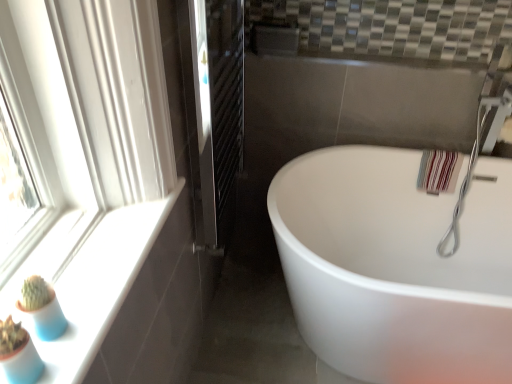
Where is `silver metallic faucet at upper right`? The height and width of the screenshot is (384, 512). silver metallic faucet at upper right is located at coordinates (483, 132).

Locate an element on the screen. The image size is (512, 384). white glossy window sill at lower left is located at coordinates (100, 285).

Is white glossy bathtub at center taller than black metal radiator at center?

No.

What's the angular difference between white glossy bathtub at center and black metal radiator at center's facing directions?

They differ by 88.9 degrees in their facing directions.

Which object is closer to the camera, white glossy bathtub at center or black metal radiator at center?

black metal radiator at center is closer to the camera.

Considering the sizes of objects white glossy bathtub at center and black metal radiator at center in the image provided, who is smaller, white glossy bathtub at center or black metal radiator at center?

black metal radiator at center.

From the image's perspective, is black metal radiator at center located beneath white glossy window sill at lower left?

No, from the image's perspective, black metal radiator at center is not below white glossy window sill at lower left.

Does black metal radiator at center have a greater height compared to white glossy window sill at lower left?

Yes, black metal radiator at center is taller than white glossy window sill at lower left.

From a real-world perspective, which object rests below the other?

black metal radiator at center.

Is silver metallic faucet at upper right taller than white glossy bathtub at center?

Yes.

Considering the positions of objects silver metallic faucet at upper right and white glossy bathtub at center in the image provided, who is behind, silver metallic faucet at upper right or white glossy bathtub at center?

silver metallic faucet at upper right is further away from the camera.

Is silver metallic faucet at upper right to the left or to the right of white glossy bathtub at center in the image?

Based on their positions, silver metallic faucet at upper right is located to the right of white glossy bathtub at center.

From a real-world perspective, is white glossy window sill at lower left above or below silver metallic faucet at upper right?

Clearly, from a real-world perspective, white glossy window sill at lower left is above silver metallic faucet at upper right.

The width and height of the screenshot is (512, 384). I want to click on faucet directly beneath the white glossy window sill at lower left (from a real-world perspective), so click(x=483, y=132).

Considering the sizes of white glossy window sill at lower left and silver metallic faucet at upper right in the image, is white glossy window sill at lower left taller or shorter than silver metallic faucet at upper right?

In the image, white glossy window sill at lower left appears to be shorter than silver metallic faucet at upper right.

Between silver metallic faucet at upper right and black metal radiator at center, which one appears on the left side from the viewer's perspective?

From the viewer's perspective, black metal radiator at center appears more on the left side.

Considering the sizes of objects silver metallic faucet at upper right and black metal radiator at center in the image provided, who is wider, silver metallic faucet at upper right or black metal radiator at center?

silver metallic faucet at upper right.

How different are the orientations of silver metallic faucet at upper right and black metal radiator at center in degrees?

The angular difference between silver metallic faucet at upper right and black metal radiator at center is 88.9 degrees.

Consider the image. Does silver metallic faucet at upper right touch black metal radiator at center?

silver metallic faucet at upper right and black metal radiator at center are not in contact.

Does white glossy bathtub at center contain white glossy window sill at lower left?

Definitely not — white glossy window sill at lower left is not inside white glossy bathtub at center.

Which is behind, white glossy bathtub at center or white glossy window sill at lower left?

white glossy bathtub at center is further away from the camera.

From the image's perspective, which object appears higher, white glossy bathtub at center or white glossy window sill at lower left?

white glossy window sill at lower left appears higher in the image.

Does white glossy bathtub at center turn towards white glossy window sill at lower left?

No, white glossy bathtub at center is not oriented towards white glossy window sill at lower left.

Who is shorter, silver metallic faucet at upper right or white glossy window sill at lower left?

Standing shorter between the two is white glossy window sill at lower left.

Between silver metallic faucet at upper right and white glossy window sill at lower left, which one has larger width?

silver metallic faucet at upper right is wider.

Which point is more forward, (464, 179) or (136, 226)?

The point (136, 226) is more forward.

From the image's perspective, which one is positioned higher, silver metallic faucet at upper right or white glossy window sill at lower left?

silver metallic faucet at upper right, from the image's perspective.

Where is `screen door above the white glossy bathtub at center (from the image's perspective)`? Image resolution: width=512 pixels, height=384 pixels. screen door above the white glossy bathtub at center (from the image's perspective) is located at coordinates (217, 111).

The height and width of the screenshot is (384, 512). I want to click on screen door located on the right of white glossy window sill at lower left, so click(217, 111).

Based on their spatial positions, is silver metallic faucet at upper right or white glossy window sill at lower left closer to black metal radiator at center?

white glossy window sill at lower left lies closer to black metal radiator at center than the other object.

When comparing their distances from black metal radiator at center, does white glossy window sill at lower left or silver metallic faucet at upper right seem further?

silver metallic faucet at upper right is positioned further to the anchor black metal radiator at center.

Looking at this image, when comparing their distances from white glossy window sill at lower left, does silver metallic faucet at upper right or white glossy bathtub at center seem closer?

white glossy bathtub at center is positioned closer to the anchor white glossy window sill at lower left.

Which object lies nearer to the anchor point silver metallic faucet at upper right, white glossy window sill at lower left or white glossy bathtub at center?

white glossy bathtub at center.

Which object lies nearer to the anchor point silver metallic faucet at upper right, white glossy bathtub at center or white glossy window sill at lower left?

Among the two, white glossy bathtub at center is located nearer to silver metallic faucet at upper right.

Which object lies further to the anchor point black metal radiator at center, white glossy bathtub at center or white glossy window sill at lower left?

The object further to black metal radiator at center is white glossy bathtub at center.

Based on their spatial positions, is white glossy window sill at lower left or white glossy bathtub at center closer to black metal radiator at center?

white glossy window sill at lower left.

When comparing their distances from white glossy window sill at lower left, does black metal radiator at center or silver metallic faucet at upper right seem closer?

black metal radiator at center is positioned closer to the anchor white glossy window sill at lower left.

Locate an element on the screen. Image resolution: width=512 pixels, height=384 pixels. screen door situated between white glossy window sill at lower left and silver metallic faucet at upper right from left to right is located at coordinates (217, 111).

This screenshot has height=384, width=512. I want to click on bathtub located between white glossy window sill at lower left and silver metallic faucet at upper right in the left-right direction, so click(x=396, y=266).

I want to click on bathtub between black metal radiator at center and silver metallic faucet at upper right from left to right, so click(396, 266).

I want to click on screen door between white glossy window sill at lower left and white glossy bathtub at center, so click(217, 111).